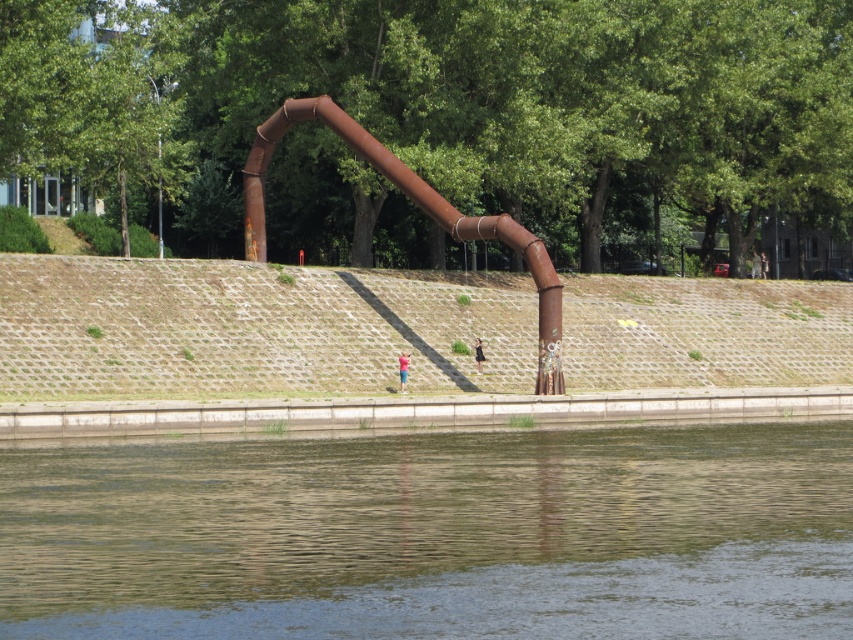
Does brown water at lower center lie in front of black fabric person at center?

Yes, it is in front of black fabric person at center.

Which is in front, point (399, 573) or point (479, 364)?

Point (399, 573)

Locate an element on the screen. The height and width of the screenshot is (640, 853). brown water at lower center is located at coordinates (434, 534).

Between rusty metal water pipe at center and black fabric person at center, which one has less height?

black fabric person at center is shorter.

What do you see at coordinates (418, 205) in the screenshot?
I see `rusty metal water pipe at center` at bounding box center [418, 205].

The width and height of the screenshot is (853, 640). I want to click on rusty metal water pipe at center, so click(x=418, y=205).

Is brown water at lower center above light blue shirt at center?

Actually, brown water at lower center is below light blue shirt at center.

Which of these two, brown water at lower center or light blue shirt at center, stands taller?

Standing taller between the two is light blue shirt at center.

The width and height of the screenshot is (853, 640). Describe the element at coordinates (434, 534) in the screenshot. I see `brown water at lower center` at that location.

Where is `brown water at lower center`? This screenshot has width=853, height=640. brown water at lower center is located at coordinates (434, 534).